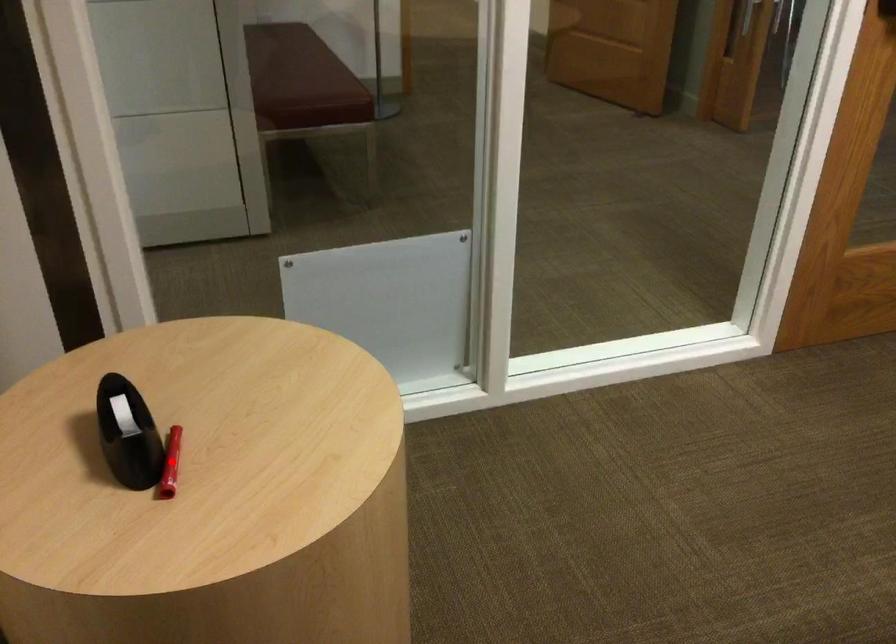
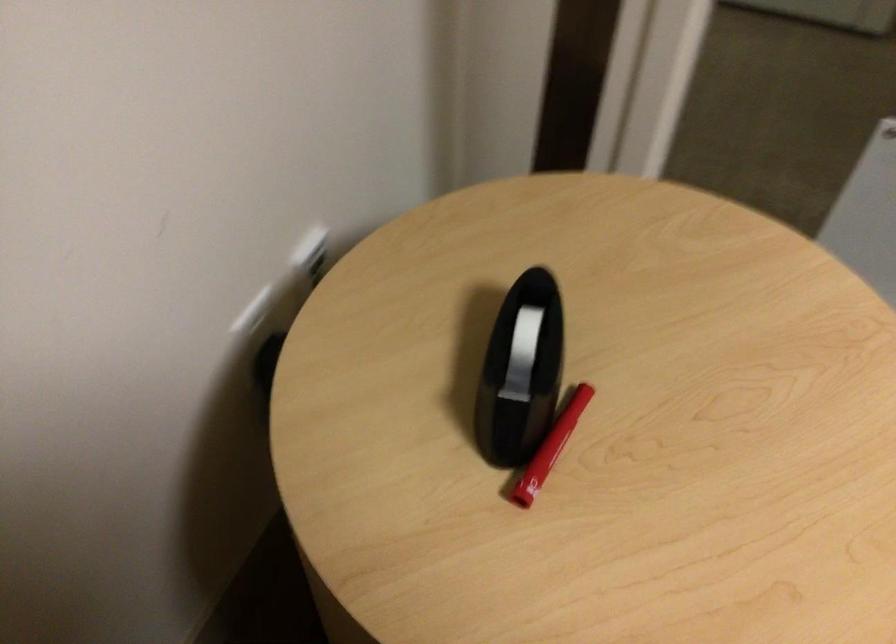
Locate, in the second image, the point that corresponds to the highlighted location in the first image.

(557, 438)